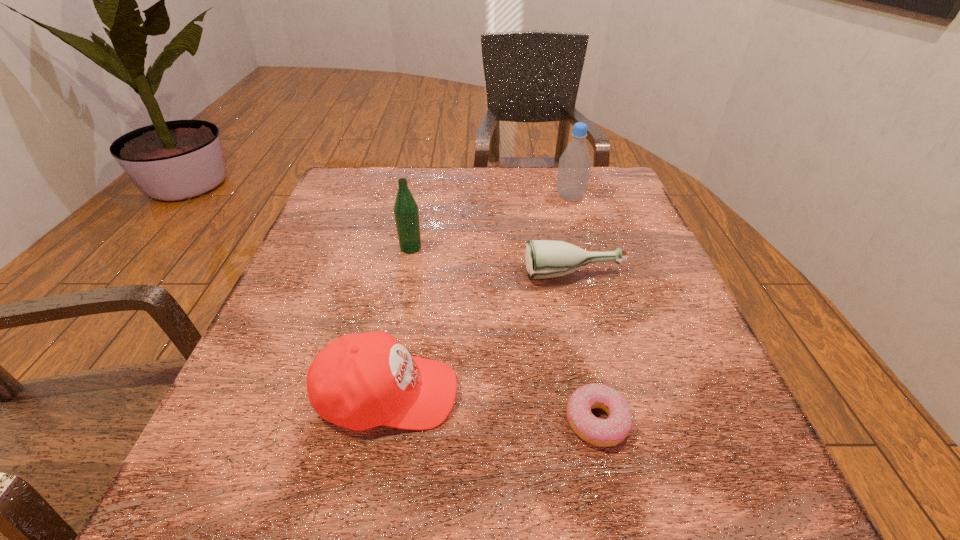
Where is `free area in between the baseball cap and the shortest object`? This screenshot has height=540, width=960. free area in between the baseball cap and the shortest object is located at coordinates (492, 408).

The image size is (960, 540). I want to click on vacant space that's between the farthest bottle and the doughnut, so click(584, 309).

Find the location of `the third closest object to the doughnut`. the third closest object to the doughnut is located at coordinates (406, 212).

Locate which object ranks third in proximity to the third nearest object. Please provide its 2D coordinates. Your answer should be formatted as a tuple, i.e. [(x, y)], where the tuple contains the x and y coordinates of a point satisfying the conditions above.

[(574, 167)]

Select which bottle is the closest to the third shortest object. Please provide its 2D coordinates. Your answer should be formatted as a tuple, i.e. [(x, y)], where the tuple contains the x and y coordinates of a point satisfying the conditions above.

[(544, 258)]

This screenshot has height=540, width=960. Identify the location of the second closest bottle relative to the third shortest object. (406, 212).

The height and width of the screenshot is (540, 960). I want to click on blank space that satisfies the following two spatial constraints: 1. on the front panel of the shortest object; 2. on the left side of the baseball cap, so 382,421.

Locate an element on the screen. This screenshot has width=960, height=540. vacant space that satisfies the following two spatial constraints: 1. on the front panel of the shortest object; 2. on the left side of the baseball cap is located at coordinates (382, 421).

Locate an element on the screen. blank area in the image that satisfies the following two spatial constraints: 1. on the back side of the shortest bottle; 2. on the left side of the farthest bottle is located at coordinates (555, 197).

The image size is (960, 540). Identify the location of vacant space that satisfies the following two spatial constraints: 1. on the front side of the second tallest bottle; 2. on the right side of the shortest object. (377, 421).